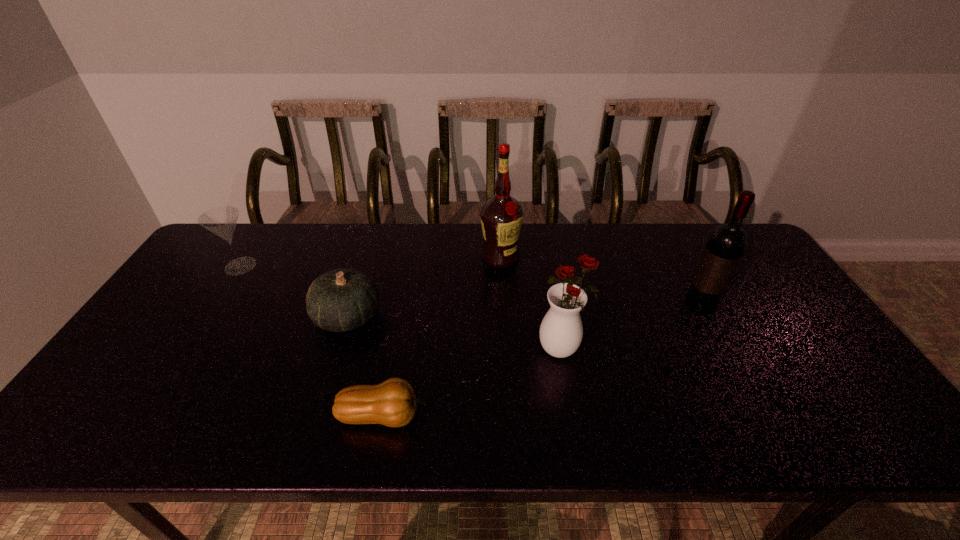
Locate an element on the screen. This screenshot has height=540, width=960. the third object from right to left is located at coordinates (501, 216).

Where is `wine bottle`? This screenshot has height=540, width=960. wine bottle is located at coordinates (726, 244).

This screenshot has width=960, height=540. Identify the location of the fifth object from left to right. (561, 331).

Find the location of a particular element. The width and height of the screenshot is (960, 540). vase is located at coordinates (561, 331).

At what (x,y) coordinates should I click in order to perform the action: click on the leftmost object. Please return your answer as a coordinate pair (x, y). The image size is (960, 540). Looking at the image, I should click on (221, 221).

What are the coordinates of `flute glass` in the screenshot? It's located at (221, 221).

Locate an element on the screen. the farther gourd is located at coordinates (343, 299).

Find the location of `the taller gourd`. the taller gourd is located at coordinates (343, 299).

Identify the location of the shortest object. (392, 403).

The height and width of the screenshot is (540, 960). I want to click on the nearest object, so click(x=392, y=403).